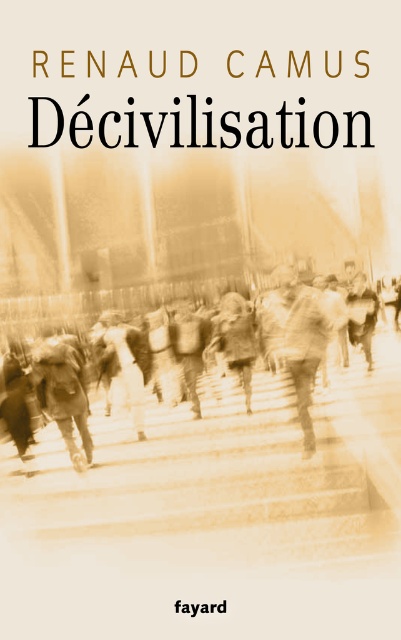
Consider the image. You are an observer looking at the book cover. The sepia stone stairs at center and the sepia textured crowd at center are both present. Which object is positioned lower in the image?

The sepia stone stairs at center is located below the sepia textured crowd at center, so it is positioned lower in the image.

Based on the photo, based on the book cover described, which object occupies more space in the image? Please refer to the objects listed below for your answer. Objects to consider are the sepia stone stairs at center and the sepia textured crowd at center.

The sepia textured crowd at center occupies more space in the image than the sepia stone stairs at center.